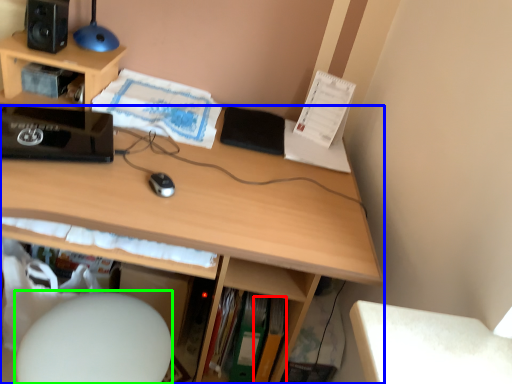
Question: Which is farther away from paperback book (highlighted by a red box)? desk (highlighted by a blue box) or computer chair (highlighted by a green box)?

Choices:
 (A) desk
 (B) computer chair

Answer: (B)